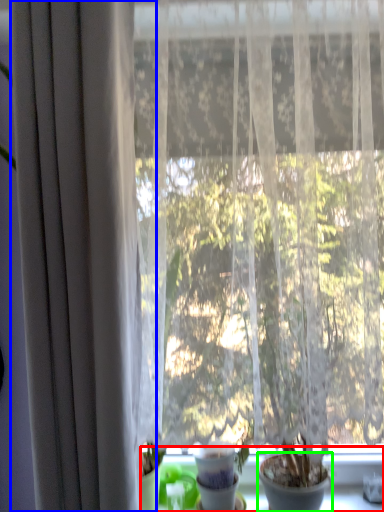
Question: Which object is positioned farthest from window sill (highlighted by a red box)? Select from curtain (highlighted by a blue box) and flowerpot (highlighted by a green box).

Choices:
 (A) curtain
 (B) flowerpot

Answer: (A)